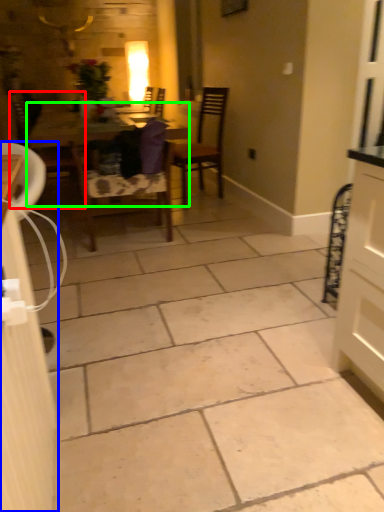
Question: Which object is the farthest from chair (highlighted by a red box)? Choose among these: cabinetry (highlighted by a blue box) or table (highlighted by a green box).

Choices:
 (A) cabinetry
 (B) table

Answer: (A)